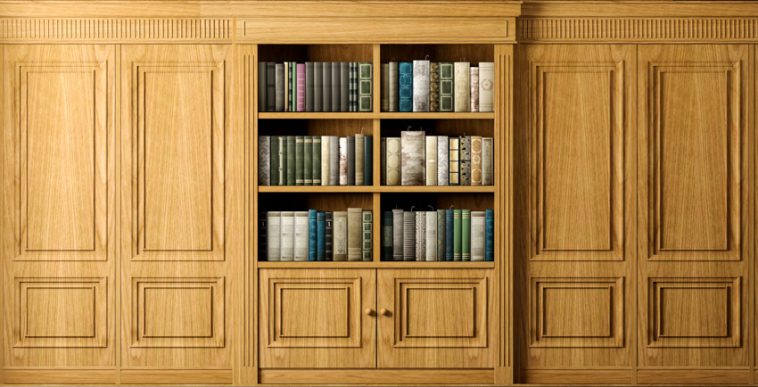
Locate an element on the screen. The height and width of the screenshot is (387, 758). 10 raised panels on the bookcase is located at coordinates (63, 181), (179, 184), (58, 320), (161, 311), (315, 318), (453, 313), (583, 183), (705, 191), (580, 320), (699, 313).